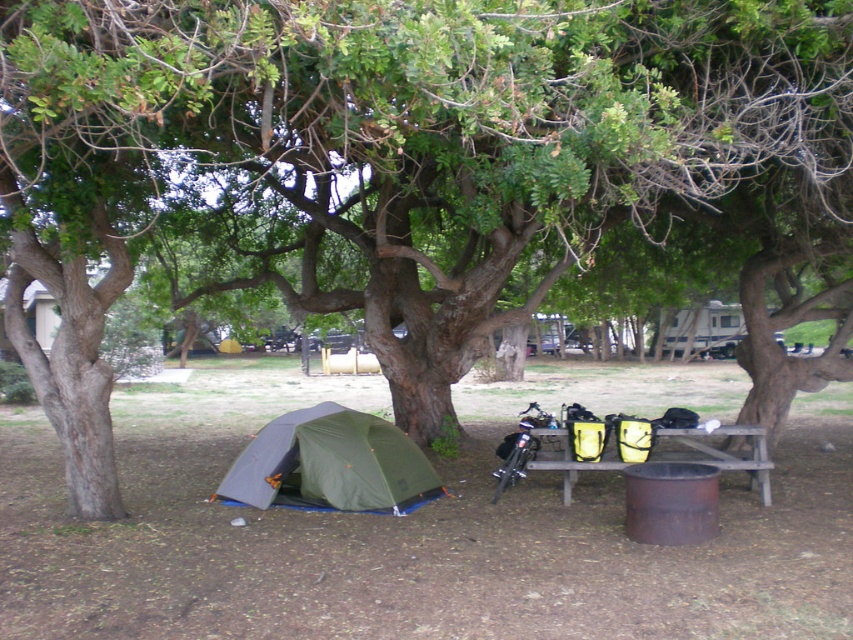
In the scene shown: Does green fabric tent at lower left have a greater height compared to wooden picnic table at center?

Yes.

Is green fabric tent at lower left above wooden picnic table at center?

No.

From the picture: Who is more forward, (350, 428) or (604, 444)?

Point (604, 444) is in front.

Locate an element on the screen. The image size is (853, 640). green fabric tent at lower left is located at coordinates (329, 465).